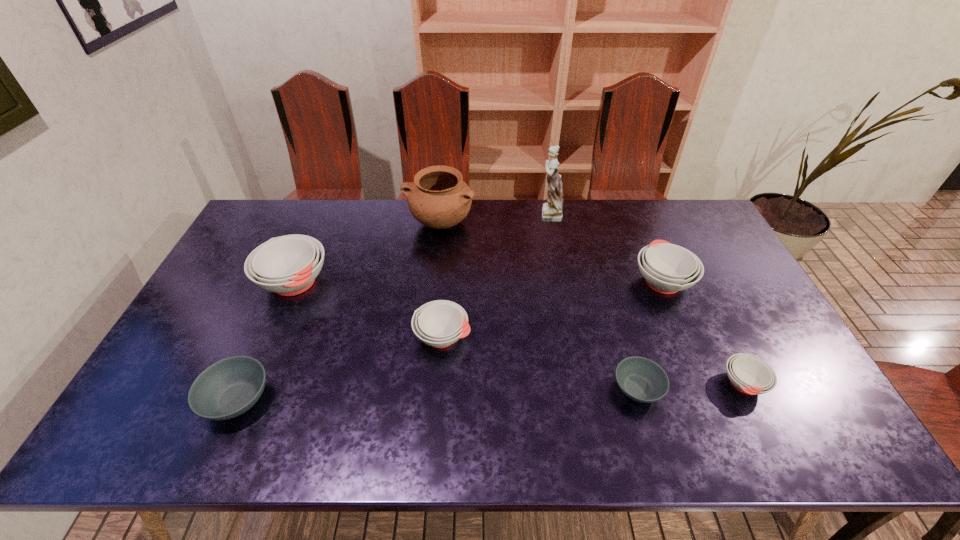
This screenshot has height=540, width=960. I want to click on the bigger gray soup bowl, so click(x=228, y=388).

Locate an element on the screen. The width and height of the screenshot is (960, 540). the smallest white soup bowl is located at coordinates (748, 374).

Where is `the shortest soup bowl`? The height and width of the screenshot is (540, 960). the shortest soup bowl is located at coordinates (641, 379).

The width and height of the screenshot is (960, 540). Identify the location of the third soup bowl from right to left. (641, 379).

Where is `vacant position located 0.300m on the front-facing side of the tallest object`? vacant position located 0.300m on the front-facing side of the tallest object is located at coordinates (451, 214).

Where is `free space located 0.290m on the front-facing side of the tallest object`? free space located 0.290m on the front-facing side of the tallest object is located at coordinates (454, 214).

The image size is (960, 540). Identify the location of free space located 0.250m on the front-facing side of the tallest object. (465, 214).

The image size is (960, 540). I want to click on vacant space located 0.280m on the front of the terracotta pottery, so click(432, 303).

Image resolution: width=960 pixels, height=540 pixels. I want to click on vacant region located 0.070m on the right of the tallest soup bowl, so click(353, 282).

This screenshot has height=540, width=960. Find the location of `vacant area located 0.310m on the front of the fifth shortest soup bowl`. vacant area located 0.310m on the front of the fifth shortest soup bowl is located at coordinates (712, 400).